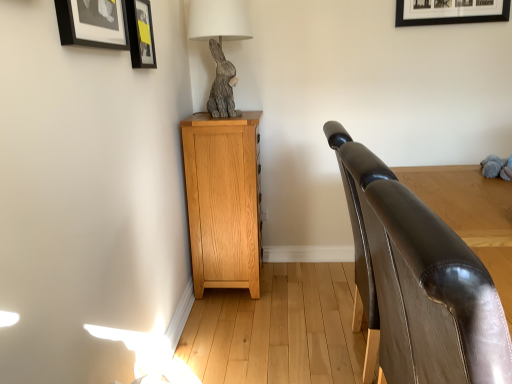
Identify the location of vacant space to the right of light oak cabinet at left. (302, 286).